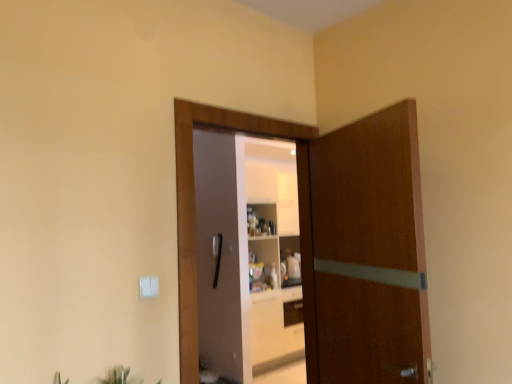
Find the location of a particular element. This screenshot has width=512, height=384. brown wooden door at center, the second door when ordered from left to right is located at coordinates click(x=364, y=252).

The width and height of the screenshot is (512, 384). What do you see at coordinates (333, 241) in the screenshot? I see `wooden door at center, the second door when ordered from right to left` at bounding box center [333, 241].

At what (x,y) coordinates should I click in order to perform the action: click on wooden door at center, the 1th door in the left-to-right sequence. Please return your answer as a coordinate pair (x, y). The height and width of the screenshot is (384, 512). Looking at the image, I should click on (333, 241).

You are a GUI agent. You are given a task and a screenshot of the screen. Output one action in this format:
    pyautogui.click(x=<x>, y=<y>)
    Task: Click on the green leafy plant at lower center
    
    Given the screenshot: What is the action you would take?
    pyautogui.click(x=118, y=376)

Starting from the green leafy plant at lower center, which door is the 2nd one behind? Please provide its 2D coordinates.

[(333, 241)]

Is point (102, 379) closer to viewer compared to point (307, 161)?

That is True.

Is wooden door at center, the 1th door in the left-to-right sequence, surrounded by green leafy plant at lower center?

No, wooden door at center, the 1th door in the left-to-right sequence, is not surrounded by green leafy plant at lower center.

Considering the sizes of objects green leafy plant at lower center and wooden door at center, the 1th door in the left-to-right sequence, in the image provided, who is taller, green leafy plant at lower center or wooden door at center, the 1th door in the left-to-right sequence,?

wooden door at center, the 1th door in the left-to-right sequence.

Is brown wooden door at center, which is the 1th door from right to left, thinner than green leafy plant at lower center?

Correct, the width of brown wooden door at center, which is the 1th door from right to left, is less than that of green leafy plant at lower center.

From a real-world perspective, is brown wooden door at center, the second door when ordered from left to right, over green leafy plant at lower center?

Yes, from a real-world perspective, brown wooden door at center, the second door when ordered from left to right, is on top of green leafy plant at lower center.

Can you tell me how much brown wooden door at center, the second door when ordered from left to right, and green leafy plant at lower center differ in facing direction?

111 degrees separate the facing orientations of brown wooden door at center, the second door when ordered from left to right, and green leafy plant at lower center.

Is brown wooden door at center, the second door when ordered from left to right, bigger than green leafy plant at lower center?

Yes.

Measure the distance between green leafy plant at lower center and brown wooden door at center, which is the 1th door from right to left.

green leafy plant at lower center and brown wooden door at center, which is the 1th door from right to left, are 3.63 feet apart from each other.

Is green leafy plant at lower center facing towards brown wooden door at center, the second door when ordered from left to right?

No.

Considering the relative sizes of green leafy plant at lower center and brown wooden door at center, the second door when ordered from left to right, in the image provided, is green leafy plant at lower center shorter than brown wooden door at center, the second door when ordered from left to right,?

Yes, green leafy plant at lower center is shorter than brown wooden door at center, the second door when ordered from left to right.

Considering the relative sizes of green leafy plant at lower center and brown wooden door at center, which is the 1th door from right to left, in the image provided, is green leafy plant at lower center wider than brown wooden door at center, which is the 1th door from right to left,?

Yes, green leafy plant at lower center is wider than brown wooden door at center, which is the 1th door from right to left.

Looking at this image, does wooden door at center, the 1th door in the left-to-right sequence, have a lesser height compared to brown wooden door at center, which is the 1th door from right to left?

No, wooden door at center, the 1th door in the left-to-right sequence, is not shorter than brown wooden door at center, which is the 1th door from right to left.

Consider the image. From the image's perspective, is wooden door at center, the 1th door in the left-to-right sequence, above or below brown wooden door at center, which is the 1th door from right to left?

Based on their image positions, wooden door at center, the 1th door in the left-to-right sequence, is located above brown wooden door at center, which is the 1th door from right to left.

Is brown wooden door at center, which is the 1th door from right to left, surrounded by wooden door at center, the 1th door in the left-to-right sequence?

Definitely not — brown wooden door at center, which is the 1th door from right to left, is not inside wooden door at center, the 1th door in the left-to-right sequence.

Based on their sizes in the image, would you say wooden door at center, the second door when ordered from right to left, is bigger or smaller than brown wooden door at center, the second door when ordered from left to right?

wooden door at center, the second door when ordered from right to left, is smaller than brown wooden door at center, the second door when ordered from left to right.

Based on their positions, is wooden door at center, the second door when ordered from right to left, located to the left or right of green leafy plant at lower center?

Based on their positions, wooden door at center, the second door when ordered from right to left, is located to the right of green leafy plant at lower center.

What are the coordinates of `plant in front of the wooden door at center, the 1th door in the left-to-right sequence` in the screenshot? It's located at (118, 376).

Is there a large distance between wooden door at center, the second door when ordered from right to left, and green leafy plant at lower center?

wooden door at center, the second door when ordered from right to left, is positioned a significant distance from green leafy plant at lower center.

From a real-world perspective, relative to green leafy plant at lower center, is wooden door at center, the 1th door in the left-to-right sequence, vertically above or below?

wooden door at center, the 1th door in the left-to-right sequence, is above green leafy plant at lower center.

Is point (316, 295) closer or farther from the camera than point (338, 159)?

Clearly, point (316, 295) is more distant from the camera than point (338, 159).

Does brown wooden door at center, which is the 1th door from right to left, have a smaller size compared to wooden door at center, the second door when ordered from right to left?

No.

Which of these two, brown wooden door at center, the second door when ordered from left to right, or wooden door at center, the 1th door in the left-to-right sequence, is thinner?

wooden door at center, the 1th door in the left-to-right sequence.

Can you confirm if brown wooden door at center, the second door when ordered from left to right, is positioned to the right of wooden door at center, the second door when ordered from right to left?

Yes, brown wooden door at center, the second door when ordered from left to right, is to the right of wooden door at center, the second door when ordered from right to left.

The width and height of the screenshot is (512, 384). Identify the location of plant lying on the left of wooden door at center, the 1th door in the left-to-right sequence. (118, 376).

Identify the location of plant below the brown wooden door at center, which is the 1th door from right to left (from the image's perspective). The height and width of the screenshot is (384, 512). 118,376.

Considering their positions, is brown wooden door at center, which is the 1th door from right to left, positioned further to green leafy plant at lower center than wooden door at center, the second door when ordered from right to left?

The object further to green leafy plant at lower center is brown wooden door at center, which is the 1th door from right to left.

Looking at the image, which one is located further to brown wooden door at center, the second door when ordered from left to right, green leafy plant at lower center or wooden door at center, the second door when ordered from right to left?

The object further to brown wooden door at center, the second door when ordered from left to right, is green leafy plant at lower center.

When comparing their distances from wooden door at center, the 1th door in the left-to-right sequence, does green leafy plant at lower center or brown wooden door at center, the second door when ordered from left to right, seem further?

Based on the image, green leafy plant at lower center appears to be further to wooden door at center, the 1th door in the left-to-right sequence.

Based on their spatial positions, is brown wooden door at center, which is the 1th door from right to left, or green leafy plant at lower center further from wooden door at center, the 1th door in the left-to-right sequence?

Based on the image, green leafy plant at lower center appears to be further to wooden door at center, the 1th door in the left-to-right sequence.

When comparing their distances from brown wooden door at center, which is the 1th door from right to left, does wooden door at center, the 1th door in the left-to-right sequence, or green leafy plant at lower center seem further?

The object further to brown wooden door at center, which is the 1th door from right to left, is green leafy plant at lower center.

Estimate the real-world distances between objects in this image. Which object is closer to green leafy plant at lower center, wooden door at center, the 1th door in the left-to-right sequence, or brown wooden door at center, the second door when ordered from left to right?

Based on the image, wooden door at center, the 1th door in the left-to-right sequence, appears to be nearer to green leafy plant at lower center.

Find the location of `door situated between green leafy plant at lower center and brown wooden door at center, which is the 1th door from right to left, from left to right`. door situated between green leafy plant at lower center and brown wooden door at center, which is the 1th door from right to left, from left to right is located at coordinates (333, 241).